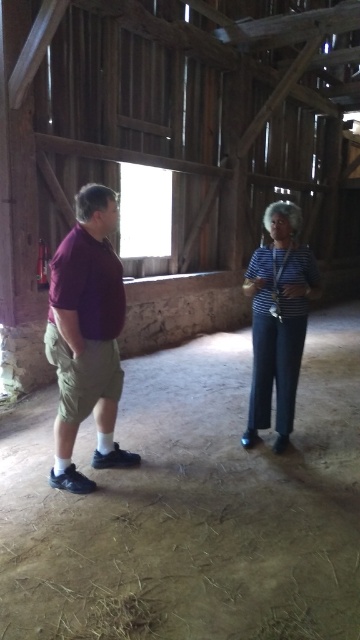
Question: Among these points, which one is farthest from the camera?

Choices:
 (A) (60, 276)
 (B) (267, 358)

Answer: (B)

Question: Is maroon fabric shirt at left thinner than matte purple shirt at left?

Choices:
 (A) yes
 (B) no

Answer: (B)

Question: Can you confirm if matte purple shirt at left is positioned below striped fabric shirt at center?

Choices:
 (A) no
 (B) yes

Answer: (B)

Question: Which point appears closest to the camera in this image?

Choices:
 (A) (69, 352)
 (B) (285, 420)

Answer: (A)

Question: Which of the following is the farthest from the observer?

Choices:
 (A) (262, 248)
 (B) (47, 323)
 (C) (259, 282)

Answer: (B)

Question: Can you confirm if matte purple shirt at left is bigger than striped fabric shirt at center?

Choices:
 (A) no
 (B) yes

Answer: (B)